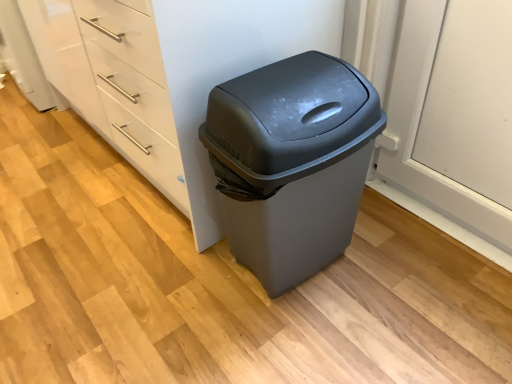
At what (x,y) coordinates should I click in order to perform the action: click on vacant area that is in front of matte gray plastic trash can at center. Please return your answer as a coordinate pair (x, y). This screenshot has width=512, height=384. Looking at the image, I should click on (317, 342).